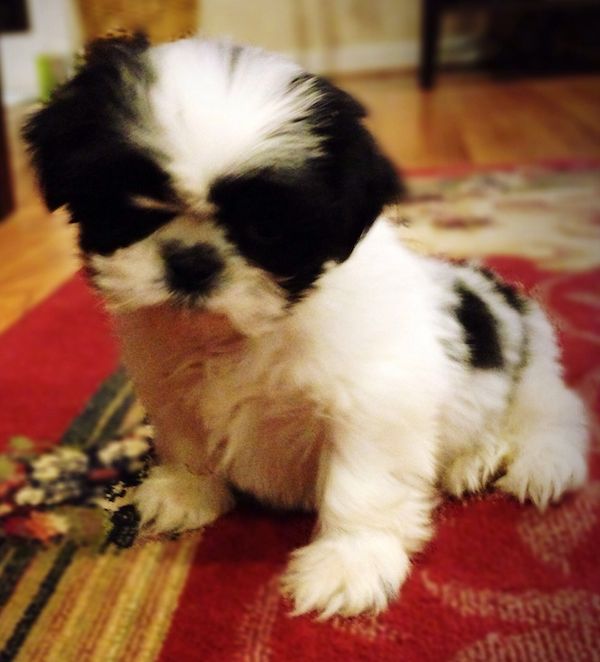
Locate an element on the screen. The image size is (600, 662). wood floor is located at coordinates pos(460,115).